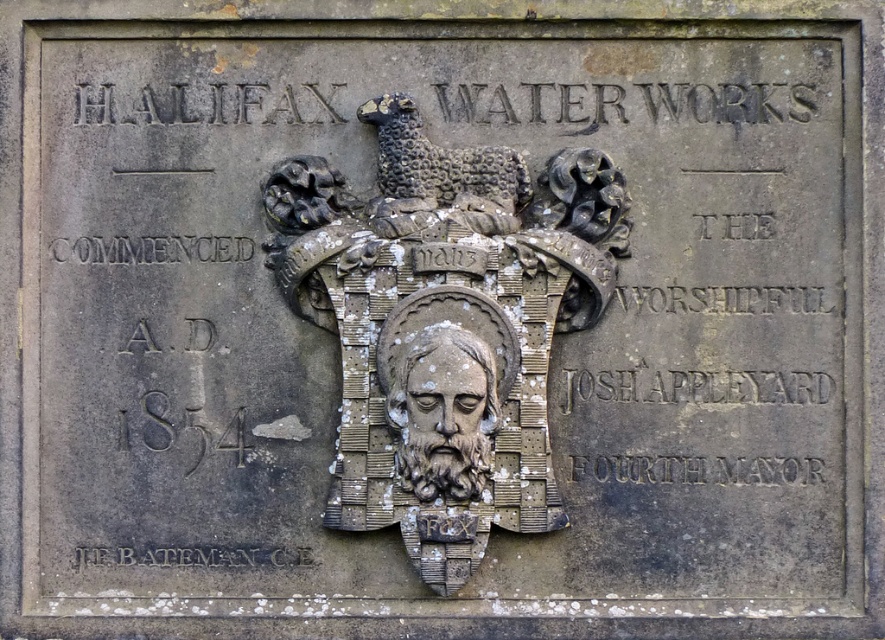
What is the relationship in position between the rusty metal shield at center and the gray stone face at center on the Halifax Water Works plaque?

The rusty metal shield at center is located above the gray stone face at center.

What is the exact location of the rusty metal shield at center on the plaque?

Result: The rusty metal shield at center is located at point (445, 324).